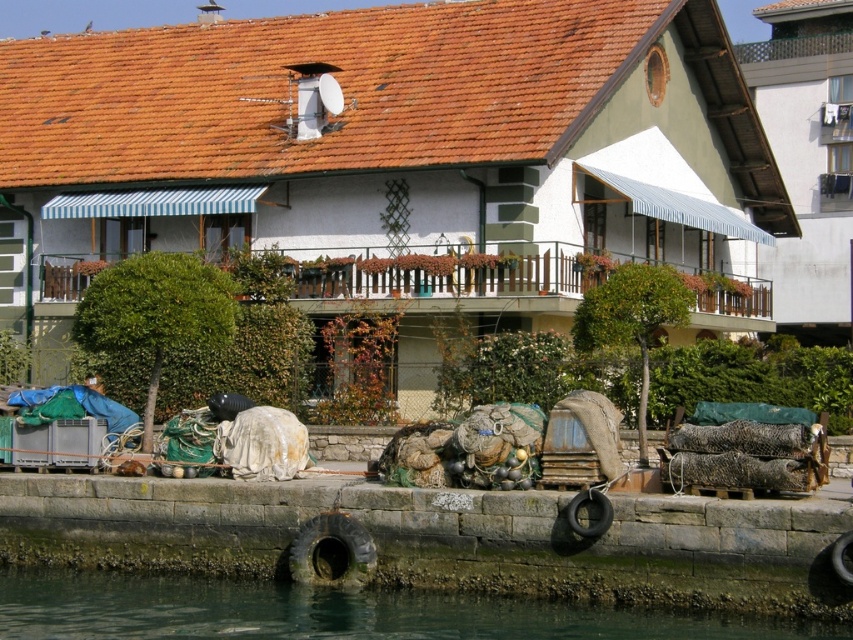
Question: Is dark gray stone dock at lower center to the right of clear water at lower left from the viewer's perspective?

Choices:
 (A) yes
 (B) no

Answer: (A)

Question: Can you confirm if dark gray stone dock at lower center is positioned to the left of clear water at lower left?

Choices:
 (A) yes
 (B) no

Answer: (B)

Question: Does dark gray stone dock at lower center have a smaller size compared to clear water at lower left?

Choices:
 (A) no
 (B) yes

Answer: (A)

Question: Which of the following is the closest to the observer?

Choices:
 (A) dark gray stone dock at lower center
 (B) clear water at lower left

Answer: (A)